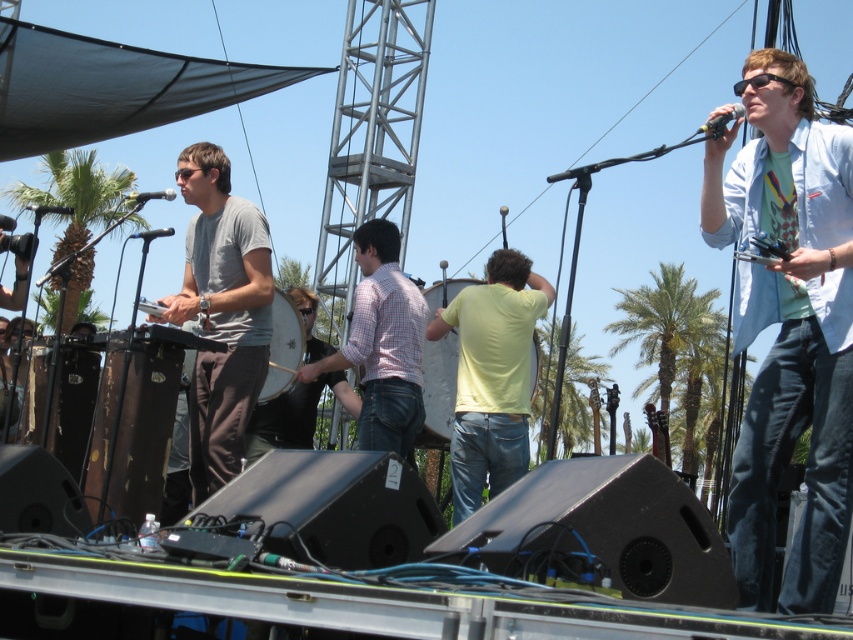
Does green leafy palm tree at center appear on the left side of black matte microphone at center?

Incorrect, green leafy palm tree at center is not on the left side of black matte microphone at center.

Is green leafy palm tree at center bigger than black matte microphone at center?

Yes.

The image size is (853, 640). What do you see at coordinates (662, 321) in the screenshot? I see `green leafy palm tree at center` at bounding box center [662, 321].

Identify the location of green leafy palm tree at center. Image resolution: width=853 pixels, height=640 pixels. (662, 321).

Can you confirm if black matte microphone at upper center is positioned above metallic silver microphone at left?

Yes.

Is black matte microphone at upper center taller than metallic silver microphone at left?

Yes.

Where is `black matte microphone at upper center`? black matte microphone at upper center is located at coordinates (151, 195).

Where is `black matte microphone at upper center`? black matte microphone at upper center is located at coordinates (151, 195).

Does light blue denim shirt at right have a smaller size compared to matte gray shirt at center?

Correct, light blue denim shirt at right occupies less space than matte gray shirt at center.

Is light blue denim shirt at right taller than matte gray shirt at center?

No, light blue denim shirt at right is not taller than matte gray shirt at center.

Where is `light blue denim shirt at right`? The height and width of the screenshot is (640, 853). light blue denim shirt at right is located at coordinates (788, 326).

The width and height of the screenshot is (853, 640). I want to click on light blue denim shirt at right, so click(788, 326).